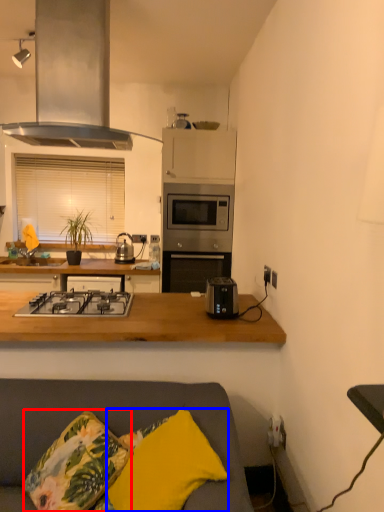
Question: Among these objects, which one is farthest to the camera, throw pillow (highlighted by a red box) or pillow (highlighted by a blue box)?

Choices:
 (A) throw pillow
 (B) pillow

Answer: (A)